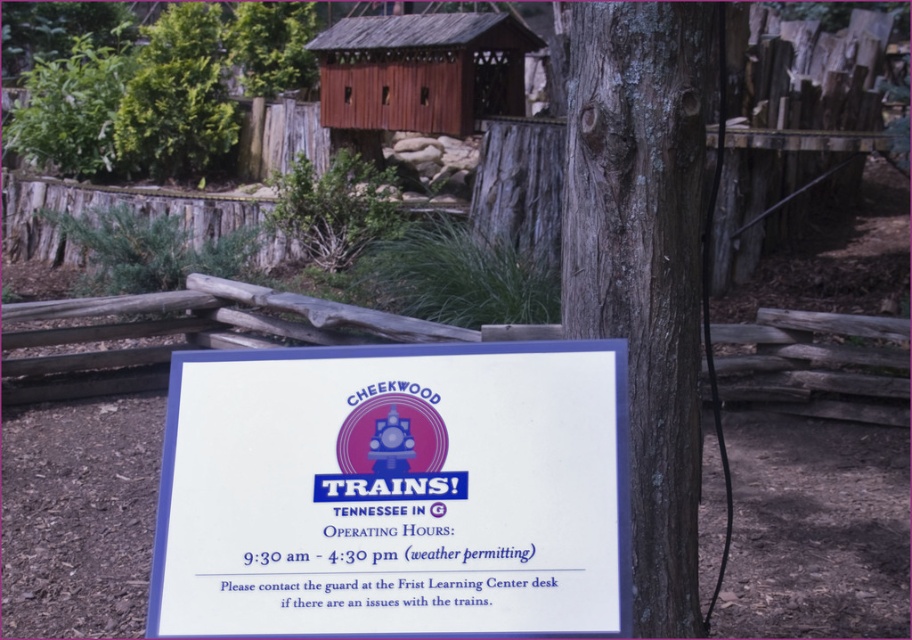
Question: Which point is farther to the camera?

Choices:
 (A) (627, 113)
 (B) (190, 600)

Answer: (A)

Question: Among these objects, which one is nearest to the camera?

Choices:
 (A) white paper sign at center
 (B) gray bark tree trunk at center

Answer: (A)

Question: Does white paper sign at center appear on the left side of gray bark tree trunk at center?

Choices:
 (A) no
 (B) yes

Answer: (B)

Question: Is white paper sign at center bigger than gray bark tree trunk at center?

Choices:
 (A) yes
 (B) no

Answer: (B)

Question: Can you confirm if white paper sign at center is smaller than gray bark tree trunk at center?

Choices:
 (A) yes
 (B) no

Answer: (A)